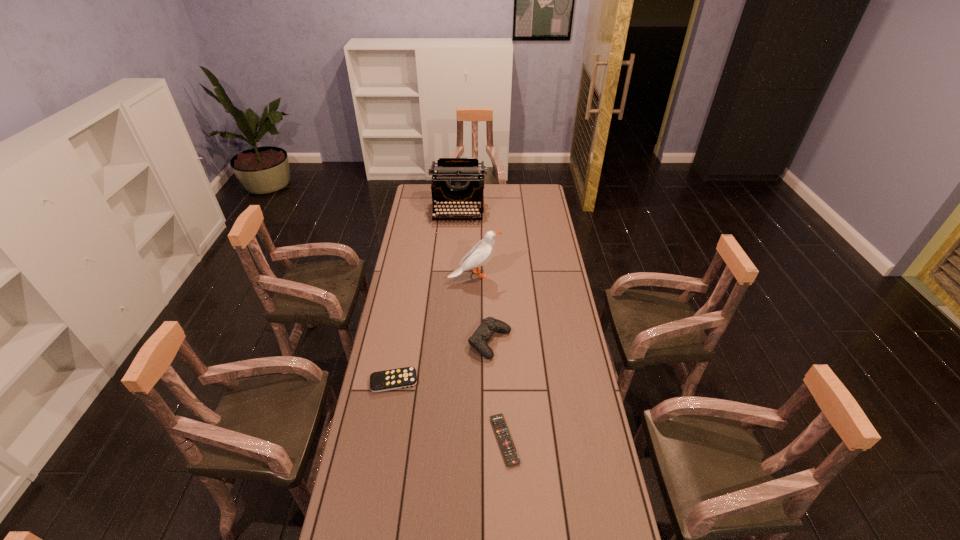
At what (x,y) coordinates should I click in order to perform the action: click on vacant space situated 0.060m on the right of the third tallest object. Please return your answer as a coordinate pair (x, y). The image size is (960, 540). Looking at the image, I should click on (526, 342).

Locate an element on the screen. The width and height of the screenshot is (960, 540). vacant position located on the right of the farther remote control is located at coordinates (449, 381).

Where is `free space located 0.180m on the left of the shorter remote control`? free space located 0.180m on the left of the shorter remote control is located at coordinates (437, 440).

The height and width of the screenshot is (540, 960). I want to click on object that is positioned at the far edge, so click(454, 180).

I want to click on typewriter at the left edge, so click(454, 180).

What are the coordinates of `remote control that is at the left edge` in the screenshot? It's located at (380, 381).

At what (x,y) coordinates should I click in order to perform the action: click on object that is at the far left corner. Please return your answer as a coordinate pair (x, y). Looking at the image, I should click on click(454, 180).

In the image, there is a desktop. What are the coordinates of `free space at the far edge` in the screenshot? It's located at (513, 198).

The image size is (960, 540). In order to click on vacant space at the left edge of the desktop in this screenshot , I will do `click(394, 474)`.

The height and width of the screenshot is (540, 960). Find the location of `vacant area at the right edge of the desktop`. vacant area at the right edge of the desktop is located at coordinates (583, 350).